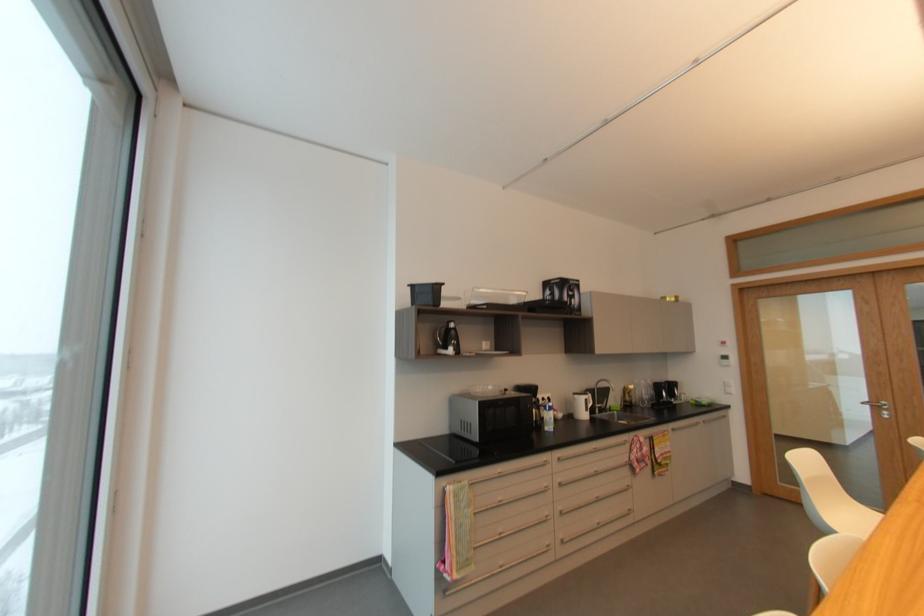
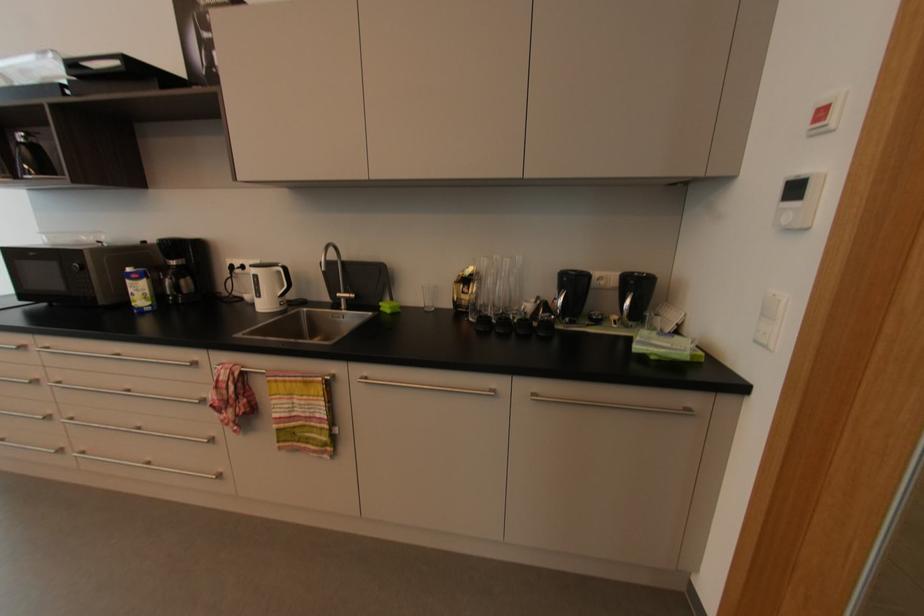
The point at [710,405] is marked in the first image. Where is the corresponding point in the second image?

(657, 358)